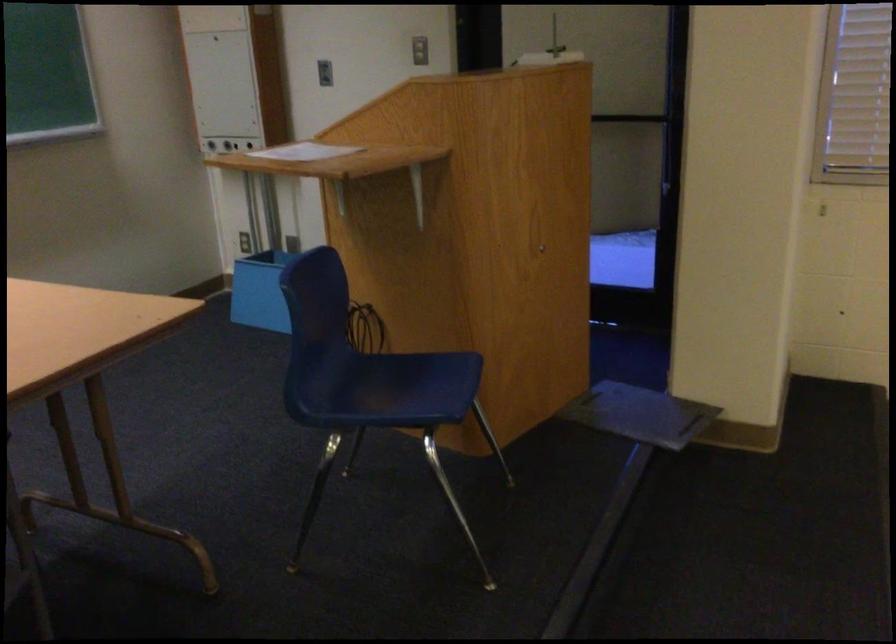
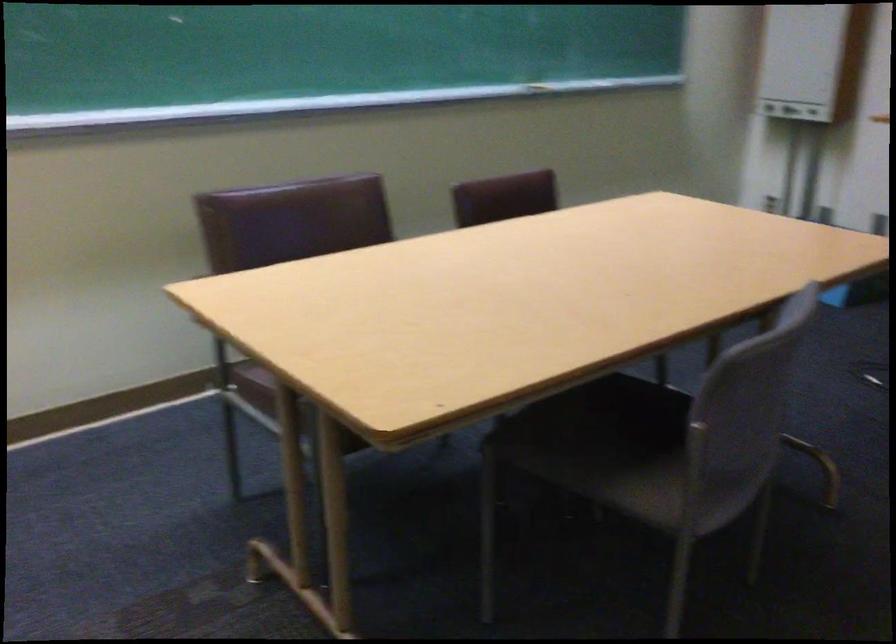
Consider the image. What movement of the cameraman would produce the second image?

The movement direction of the cameraman is left, backward.